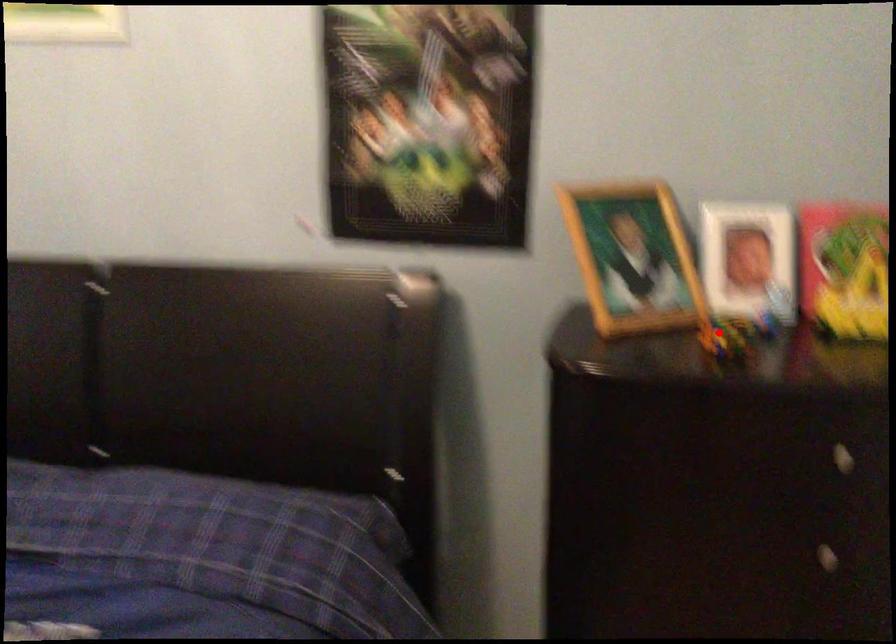
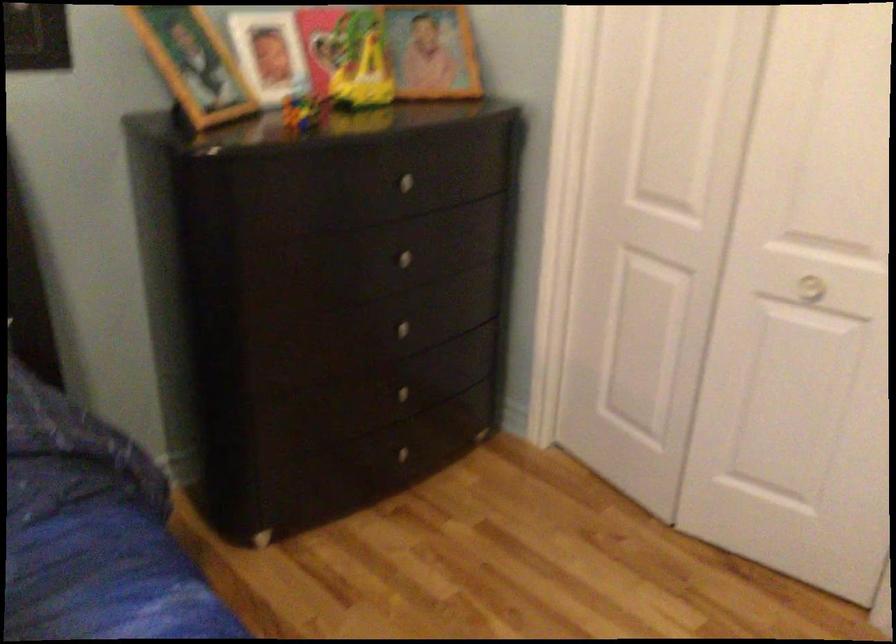
Locate, in the second image, the point that corresponds to the highlighted location in the first image.

(303, 111)